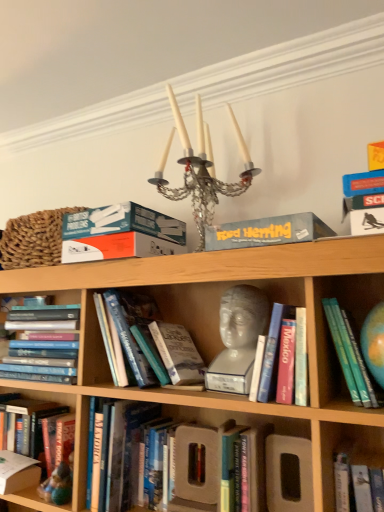
Question: From the image's perspective, is braided straw basket at upper left above or below teal matte board game box at upper center, the 2th paperback book from the left?

Choices:
 (A) above
 (B) below

Answer: (B)

Question: From a real-world perspective, is braided straw basket at upper left above or below teal matte board game box at upper center, arranged as the 1th paperback book when viewed from the top?

Choices:
 (A) below
 (B) above

Answer: (B)

Question: Estimate the real-world distances between objects in this image. Which object is closer to the hardcover book at lower left, positioned as the 1th paperback book in bottom-to-top order?

Choices:
 (A) hardcover book at center, acting as the third book starting from the left
 (B) hardcover books at center left, which ranks as the fourth book in right-to-left order
 (C) teal matte board game box at upper center, marked as the 2th paperback book in a right-to-left arrangement
 (D) braided straw basket at upper left
 (E) white marble bust at center

Answer: (B)

Question: Which object is positioned farthest from the hardcover book at lower left, which is the first book in left-to-right order?

Choices:
 (A) crystal glass candle holder at upper center
 (B) hardcover book at center, acting as the third book starting from the left
 (C) blue cardboard box at upper center, acting as the first paperback book starting from the right
 (D) teal hardcover book at right, the 5th book in the left-to-right sequence
 (E) braided straw basket at upper left

Answer: (D)